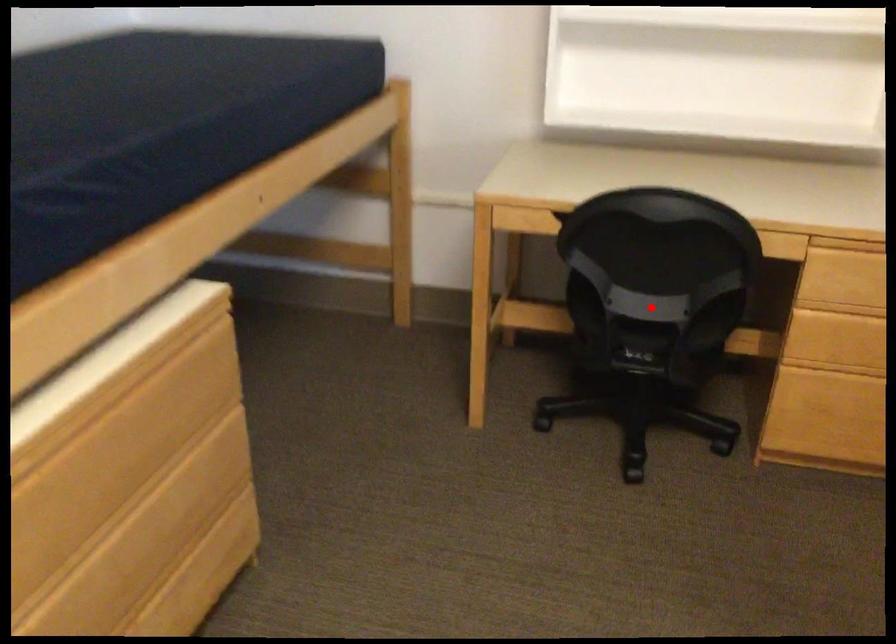
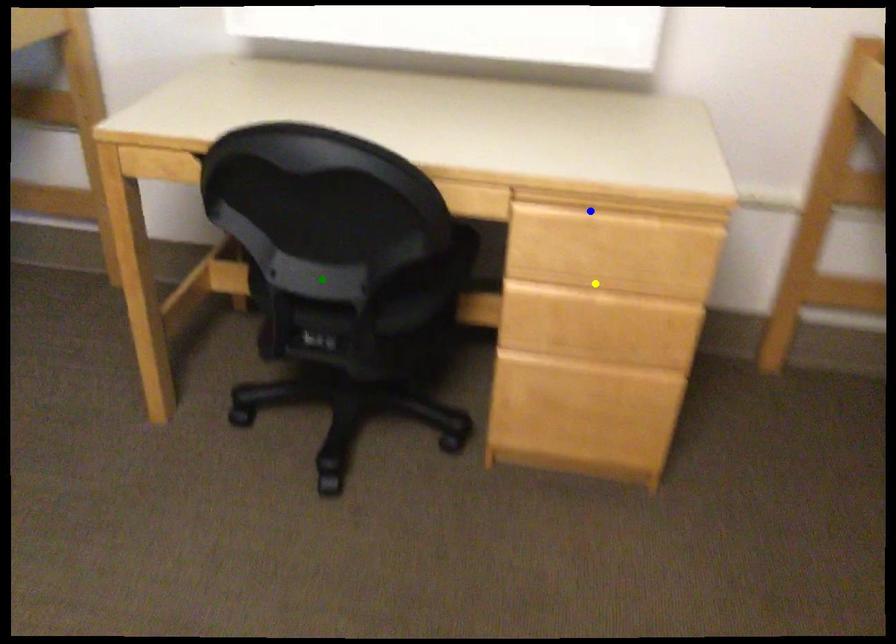
Question: I am providing you with two images of the same scene from different viewpoints. A red point is marked on the first image. You are given multiple points on the second image. Which mark in image 2 goes with the point in image 1?

Choices:
 (A) yellow point
 (B) blue point
 (C) green point

Answer: (C)